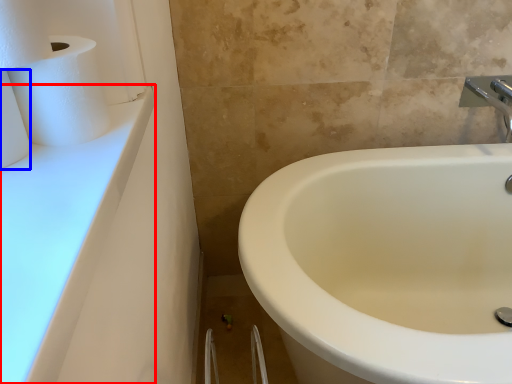
Question: Which point is further to the camera, counter top (highlighted by a red box) or toilet paper (highlighted by a blue box)?

Choices:
 (A) counter top
 (B) toilet paper

Answer: (B)